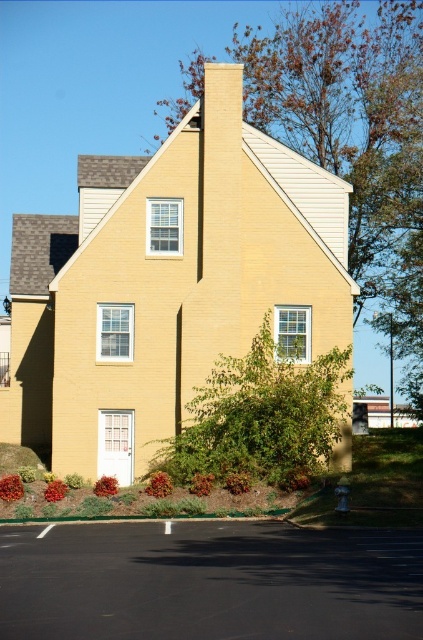
You are standing in front of the house and want to plant a new flower bed between the green leafy tree at center and the green leafy bush at center. Which one should you place the new flower bed closer to if you want it to be closer to the smaller plant?

You should place the new flower bed closer to the green leafy bush at center because it is smaller than the green leafy tree at center.

You are a gardener planning to plant a new shrub that requires a space of 1.2 meters in width. You see the green leafy tree at center and the green leafy bush at center in the garden. Which one has a wider width, and can the shrub fit next to it?

The green leafy tree at center has a wider width than the green leafy bush at center. Since the shrub requires 1.2 meters, it can fit next to the green leafy tree at center if there is sufficient space available.